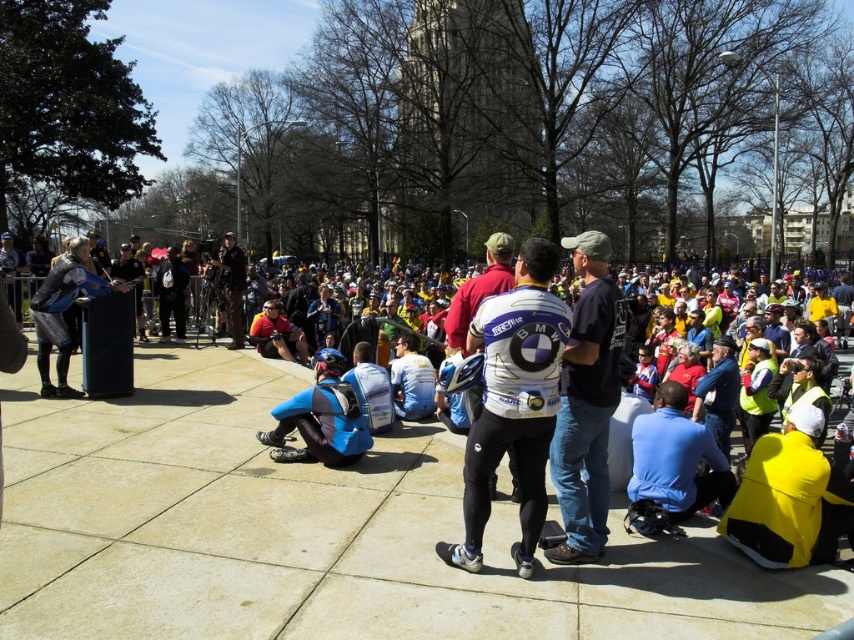
Question: Does yellow matte jacket at lower right appear under matte blue cycling jersey at center?

Choices:
 (A) no
 (B) yes

Answer: (B)

Question: Which of the following is the farthest from the observer?

Choices:
 (A) matte blue cycling jersey at center
 (B) blue synthetic suit at center

Answer: (A)

Question: Considering the real-world distances, which object is closest to the blue fabric jacket at lower right?

Choices:
 (A) dark blue jeans at center
 (B) dark blue uniform at center
 (C) white matte jersey at center

Answer: (A)

Question: Considering the relative positions of blue synthetic suit at center and dark blue uniform at center in the image provided, where is blue synthetic suit at center located with respect to dark blue uniform at center?

Choices:
 (A) left
 (B) right

Answer: (B)

Question: Is white matte jersey at center to the left of dark blue jeans at center from the viewer's perspective?

Choices:
 (A) yes
 (B) no

Answer: (A)

Question: Estimate the real-world distances between objects in this image. Which object is closer to the dark blue uniform at center?

Choices:
 (A) white matte jersey at center
 (B) dark blue jeans at center
 (C) matte black jacket at left

Answer: (C)